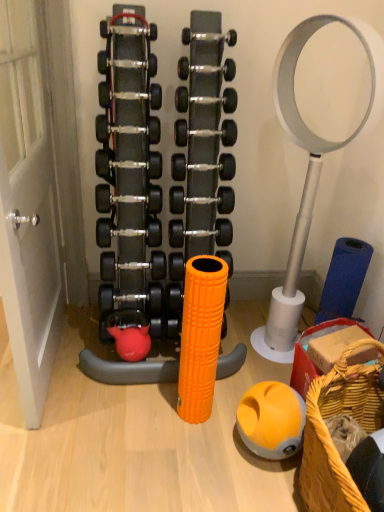
The height and width of the screenshot is (512, 384). I want to click on spots to the right of orange textured foam roller at center, so click(230, 400).